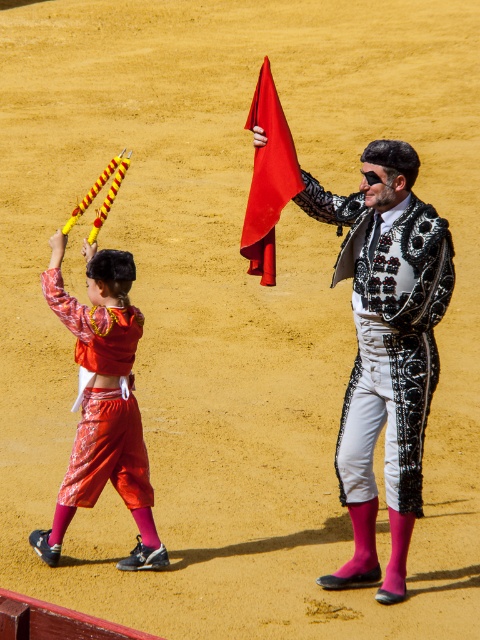
Question: Is shiny silver vest at center positioned behind shiny red pants at left?

Choices:
 (A) yes
 (B) no

Answer: (B)

Question: Among these points, which one is nearest to the camera?

Choices:
 (A) (382, 144)
 (B) (83, 464)

Answer: (A)

Question: Observing the image, what is the correct spatial positioning of shiny silver vest at center in reference to shiny red pants at left?

Choices:
 (A) above
 (B) below

Answer: (A)

Question: Is shiny silver vest at center below red satin flag at center?

Choices:
 (A) no
 (B) yes

Answer: (B)

Question: Which object is positioned farthest from the shiny silver vest at center?

Choices:
 (A) shiny red pants at left
 (B) red satin flag at center

Answer: (A)

Question: Which point is farther to the camera?

Choices:
 (A) (373, 477)
 (B) (285, 144)
 (C) (107, 276)

Answer: (B)